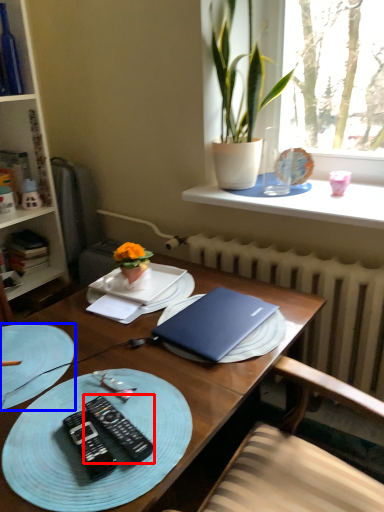
Question: Which point is closer to the camera, remote control (highlighted by a red box) or tableware (highlighted by a blue box)?

Choices:
 (A) remote control
 (B) tableware

Answer: (A)